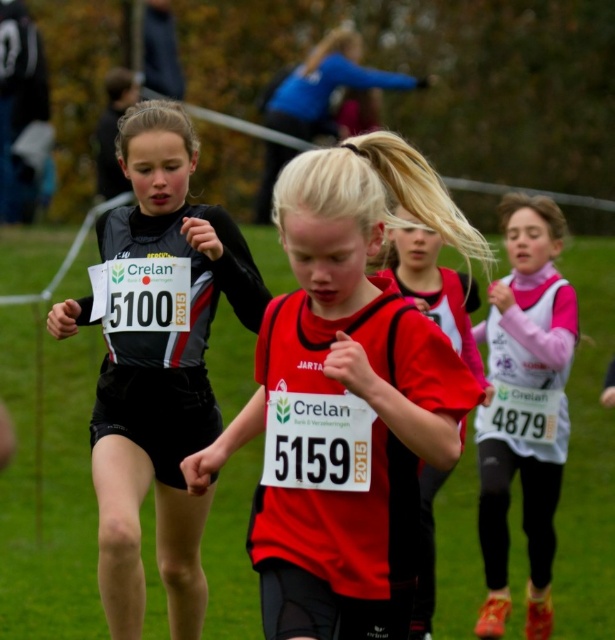
Question: Is black matte jersey at left wider than red matte jersey at center?

Choices:
 (A) yes
 (B) no

Answer: (A)

Question: Is matte red shirt at center to the left of black matte jersey at left from the viewer's perspective?

Choices:
 (A) no
 (B) yes

Answer: (A)

Question: Which of the following is the closest to the observer?

Choices:
 (A) (434, 547)
 (B) (526, 476)

Answer: (A)

Question: Does matte red shirt at center appear under black matte jersey at left?

Choices:
 (A) no
 (B) yes

Answer: (A)

Question: Which point is closer to the camera?

Choices:
 (A) pink fabric bib at right
 (B) black matte jersey at left
 (C) matte red shirt at center

Answer: (C)

Question: Which is nearer to the black matte jersey at left?

Choices:
 (A) matte red shirt at center
 (B) pink fabric bib at right

Answer: (A)